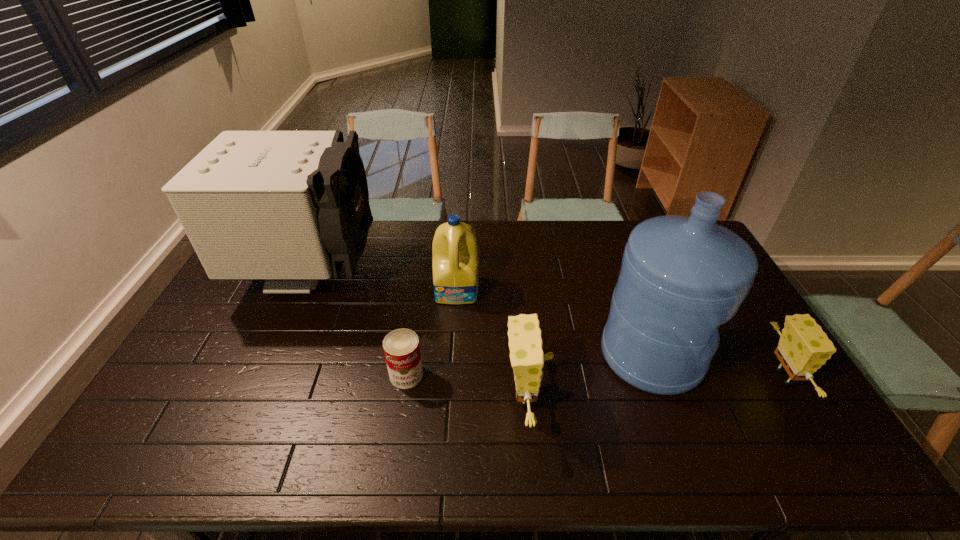
Where is `free space located 0.210m on the face of the fourth object from left to right`? The height and width of the screenshot is (540, 960). free space located 0.210m on the face of the fourth object from left to right is located at coordinates (626, 397).

At what (x,y) coordinates should I click in order to perform the action: click on vacant space located on the right of the fan. Please return your answer as a coordinate pair (x, y). Looking at the image, I should click on (444, 275).

Where is `blank area located 0.070m on the side of the fifth object from left to right with the handle`? This screenshot has width=960, height=540. blank area located 0.070m on the side of the fifth object from left to right with the handle is located at coordinates (726, 355).

Find the location of a particular element. The width and height of the screenshot is (960, 540). free space located on the label of the third tallest object is located at coordinates (454, 354).

Where is `free space located on the front label of the can`? The image size is (960, 540). free space located on the front label of the can is located at coordinates (400, 412).

Where is `object at the far edge`? This screenshot has height=540, width=960. object at the far edge is located at coordinates (291, 207).

At what (x,y) coordinates should I click in order to perform the action: click on water jug located in the near edge section of the desktop. Please return your answer as a coordinate pair (x, y). The image size is (960, 540). Looking at the image, I should click on (681, 277).

Where is `object that is at the left edge`? The image size is (960, 540). object that is at the left edge is located at coordinates (291, 207).

Find the location of a particular element. This screenshot has height=540, width=960. object located in the right edge section of the desktop is located at coordinates (804, 347).

Locate an element on the screen. The image size is (960, 540). object located at the far left corner is located at coordinates (291, 207).